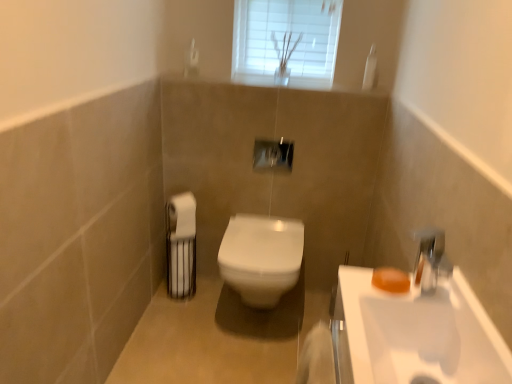
Question: From a real-world perspective, relative to white matte toilet paper at left, is orange matte soap at right vertically above or below?

Choices:
 (A) above
 (B) below

Answer: (A)

Question: Is orange matte soap at right inside the boundaries of white matte toilet paper at left, or outside?

Choices:
 (A) inside
 (B) outside

Answer: (B)

Question: Which is nearer to the white glossy sink at lower right?

Choices:
 (A) white matte toilet paper at left
 (B) white glass window at upper center
 (C) orange matte soap at right
 (D) white glossy toilet at center
 (E) chrome metallic faucet at upper right

Answer: (C)

Question: Which is nearer to the orange matte soap at right?

Choices:
 (A) white glossy sink at lower right
 (B) white glass window at upper center
 (C) white matte toilet paper at left
 (D) chrome metallic faucet at upper right
 (E) white glossy toilet at center

Answer: (D)